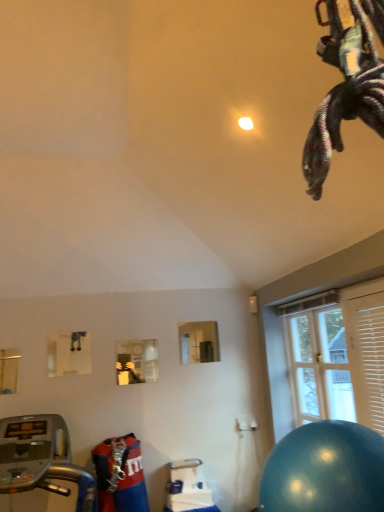
Question: Would you say wooden blinds at right is outside clear glass door at right?

Choices:
 (A) no
 (B) yes

Answer: (B)

Question: Considering the relative sizes of wooden blinds at right and clear glass door at right in the image provided, is wooden blinds at right shorter than clear glass door at right?

Choices:
 (A) no
 (B) yes

Answer: (B)

Question: From the image's perspective, is wooden blinds at right on top of clear glass door at right?

Choices:
 (A) no
 (B) yes

Answer: (B)

Question: Does wooden blinds at right lie in front of clear glass door at right?

Choices:
 (A) yes
 (B) no

Answer: (A)

Question: Does wooden blinds at right have a greater height compared to clear glass door at right?

Choices:
 (A) yes
 (B) no

Answer: (B)

Question: Looking at their shapes, would you say wooden blinds at right is wider or thinner than shiny blue ball at lower right?

Choices:
 (A) wide
 (B) thin

Answer: (B)

Question: Is point (377, 297) positioned closer to the camera than point (319, 437)?

Choices:
 (A) closer
 (B) farther

Answer: (B)

Question: Based on their sizes in the image, would you say wooden blinds at right is bigger or smaller than shiny blue ball at lower right?

Choices:
 (A) small
 (B) big

Answer: (A)

Question: Based on their positions, is wooden blinds at right located to the left or right of shiny blue ball at lower right?

Choices:
 (A) left
 (B) right

Answer: (B)

Question: Is shiny blue ball at lower right spatially inside wooden blinds at right, or outside of it?

Choices:
 (A) outside
 (B) inside

Answer: (A)

Question: From the image's perspective, is shiny blue ball at lower right positioned above or below wooden blinds at right?

Choices:
 (A) above
 (B) below

Answer: (B)

Question: Considering the relative positions of shiny blue ball at lower right and wooden blinds at right in the image provided, is shiny blue ball at lower right to the left or to the right of wooden blinds at right?

Choices:
 (A) right
 (B) left

Answer: (B)

Question: Relative to wooden blinds at right, is shiny blue ball at lower right in front or behind?

Choices:
 (A) behind
 (B) front

Answer: (B)

Question: From a real-world perspective, is wooden blinds at right above or below silver metallic treadmill at lower left?

Choices:
 (A) above
 (B) below

Answer: (A)

Question: Considering the positions of wooden blinds at right and silver metallic treadmill at lower left in the image, is wooden blinds at right bigger or smaller than silver metallic treadmill at lower left?

Choices:
 (A) big
 (B) small

Answer: (B)